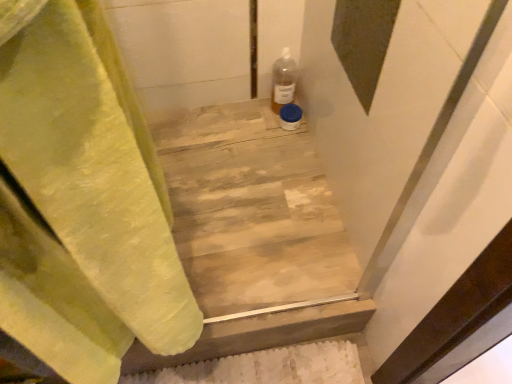
Question: Considering the positions of wooden at center and translucent plastic bottle at upper right in the image, is wooden at center wider or thinner than translucent plastic bottle at upper right?

Choices:
 (A) thin
 (B) wide

Answer: (B)

Question: Is wooden at center inside the boundaries of translucent plastic bottle at upper right, or outside?

Choices:
 (A) inside
 (B) outside

Answer: (B)

Question: Is point (222, 173) positioned closer to the camera than point (281, 64)?

Choices:
 (A) farther
 (B) closer

Answer: (B)

Question: Is translucent plastic bottle at upper right situated inside wooden at center or outside?

Choices:
 (A) outside
 (B) inside

Answer: (A)

Question: From their relative heights in the image, would you say translucent plastic bottle at upper right is taller or shorter than wooden at center?

Choices:
 (A) tall
 (B) short

Answer: (A)

Question: In terms of size, does translucent plastic bottle at upper right appear bigger or smaller than wooden at center?

Choices:
 (A) small
 (B) big

Answer: (A)

Question: From a real-world perspective, relative to wooden at center, is translucent plastic bottle at upper right vertically above or below?

Choices:
 (A) above
 (B) below

Answer: (A)